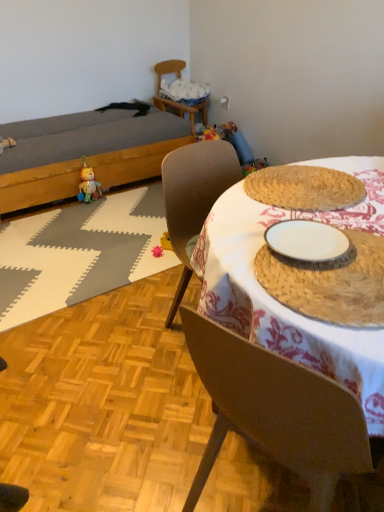
This screenshot has width=384, height=512. Identify the location of white ceramic plate at center. (330, 283).

What do you see at coordinates (79, 253) in the screenshot?
I see `woven straw placemat at center` at bounding box center [79, 253].

Describe the element at coordinates (177, 101) in the screenshot. I see `wooden chair at upper center` at that location.

Locate an element on the screen. The image size is (384, 512). matte gray bed at left is located at coordinates (87, 154).

Where is `pink rubber toy at center, the second toy from the back`? pink rubber toy at center, the second toy from the back is located at coordinates (157, 251).

This screenshot has width=384, height=512. What do you see at coordinates (307, 241) in the screenshot?
I see `white matte plate at center` at bounding box center [307, 241].

What is the approximate width of white matte plate at center?

It is 19.45 centimeters.

The width and height of the screenshot is (384, 512). I want to click on white ceramic plate at center, so click(330, 283).

Considering the positions of point (289, 258) and point (158, 154), is point (289, 258) closer or farther from the camera than point (158, 154)?

Point (289, 258).

Where is `bed above the white ceramic plate at center (from the image's perspective)`? bed above the white ceramic plate at center (from the image's perspective) is located at coordinates (87, 154).

Is white ceramic plate at center oriented away from matte gray bed at left?

No.

Is the depth of white ceramic plate at center less than that of matte gray bed at left?

Yes, white ceramic plate at center is closer to the viewer.

Between point (342, 276) and point (207, 110), which one is positioned behind?

Point (207, 110)

Is white ceramic plate at center aimed at wooden chair at upper center?

No, white ceramic plate at center is not aimed at wooden chair at upper center.

How different are the orientations of white ceramic plate at center and wooden chair at upper center in degrees?

179 degrees.

From the image's perspective, does white ceramic plate at center appear higher than wooden chair at upper center?

No, from the image's perspective, white ceramic plate at center is not on top of wooden chair at upper center.

Considering the sizes of objects pink rubber toy at center, the second toy from the back, and matte gray bed at left in the image provided, who is smaller, pink rubber toy at center, the second toy from the back, or matte gray bed at left?

pink rubber toy at center, the second toy from the back, is smaller.

At what (x,y) coordinates should I click in order to perform the action: click on the 2nd toy below the matte gray bed at left (from a real-world perspective). Please return your answer as a coordinate pair (x, y). Image resolution: width=384 pixels, height=512 pixels. Looking at the image, I should click on (157, 251).

Is pink rubber toy at center, the second toy positioned from the left, inside or outside of matte gray bed at left?

pink rubber toy at center, the second toy positioned from the left, is located beyond the bounds of matte gray bed at left.

Which object is wider, pink rubber toy at center, which is the 2th toy in top-to-bottom order, or matte gray bed at left?

matte gray bed at left.

Considering the sizes of rattan placemat at center and white ceramic plate at center in the image, is rattan placemat at center bigger or smaller than white ceramic plate at center?

Clearly, rattan placemat at center is larger in size than white ceramic plate at center.

Looking at this image, can you confirm if rattan placemat at center is taller than white ceramic plate at center?

Yes.

From a real-world perspective, is rattan placemat at center physically located above or below white ceramic plate at center?

rattan placemat at center is situated lower than white ceramic plate at center in the real world.

Does white ceramic plate at center appear on the left side of pink rubber toy at center, positioned as the first toy in bottom-to-top order?

No, white ceramic plate at center is not to the left of pink rubber toy at center, positioned as the first toy in bottom-to-top order.

Locate an element on the screen. The image size is (384, 512). tableware that appears below the pink rubber toy at center, positioned as the first toy in bottom-to-top order (from the image's perspective) is located at coordinates (330, 283).

Does white ceramic plate at center have a lesser width compared to pink rubber toy at center, the second toy positioned from the left?

No.

Can you confirm if white ceramic plate at center is smaller than pink rubber toy at center, the second toy positioned from the left?

Incorrect, white ceramic plate at center is not smaller in size than pink rubber toy at center, the second toy positioned from the left.

Consider the image. Measure the distance between woven straw placemat at center and plush yellow bear at lower left, the second toy from the right.

woven straw placemat at center is 58.66 centimeters from plush yellow bear at lower left, the second toy from the right.

From a real-world perspective, between woven straw placemat at center and plush yellow bear at lower left, arranged as the first toy when viewed from the top, who is vertically higher?

plush yellow bear at lower left, arranged as the first toy when viewed from the top.

Can you confirm if woven straw placemat at center is shorter than plush yellow bear at lower left, the 2th toy in the front-to-back sequence?

Yes.

How different are the orientations of wooden chair at upper center and pink rubber toy at center, positioned as the first toy in bottom-to-top order, in degrees?

107 degrees separate the facing orientations of wooden chair at upper center and pink rubber toy at center, positioned as the first toy in bottom-to-top order.

From their relative heights in the image, would you say wooden chair at upper center is taller or shorter than pink rubber toy at center, which is the 2th toy in top-to-bottom order?

Clearly, wooden chair at upper center is taller compared to pink rubber toy at center, which is the 2th toy in top-to-bottom order.

Which object is more forward, wooden chair at upper center or pink rubber toy at center, positioned as the first toy in bottom-to-top order?

pink rubber toy at center, positioned as the first toy in bottom-to-top order, is closer to the camera.

Considering the sizes of objects wooden chair at upper center and pink rubber toy at center, the second toy from the back, in the image provided, who is thinner, wooden chair at upper center or pink rubber toy at center, the second toy from the back,?

pink rubber toy at center, the second toy from the back.

At what (x,y) coordinates should I click in order to perform the action: click on tableware located on the right of matte gray bed at left. Please return your answer as a coordinate pair (x, y). This screenshot has height=512, width=384. Looking at the image, I should click on (330, 283).

Locate an element on the screen. This screenshot has height=512, width=384. chair behind the white ceramic plate at center is located at coordinates (177, 101).

Which object lies nearer to the anchor point wooden chair at upper center, white ceramic plate at center or pink rubber toy at center, the second toy positioned from the left?

The object closer to wooden chair at upper center is pink rubber toy at center, the second toy positioned from the left.

Which object lies nearer to the anchor point white ceramic plate at center, plush yellow bear at lower left, acting as the 1th toy starting from the left, or pink rubber toy at center, the second toy from the back?

pink rubber toy at center, the second toy from the back, is closer to white ceramic plate at center.

Which object lies nearer to the anchor point white ceramic plate at center, woven straw placemat at center or rattan placemat at center?

rattan placemat at center is closer to white ceramic plate at center.

When comparing their distances from matte gray bed at left, does plush yellow bear at lower left, the second toy from the right, or white matte plate at center seem closer?

Based on the image, plush yellow bear at lower left, the second toy from the right, appears to be nearer to matte gray bed at left.

Which object lies further to the anchor point matte gray bed at left, woven straw placemat at center or pink rubber toy at center, positioned as the 1th toy in right-to-left order?

Among the two, pink rubber toy at center, positioned as the 1th toy in right-to-left order, is located further to matte gray bed at left.

Considering their positions, is plush yellow bear at lower left, which ranks as the second toy in bottom-to-top order, positioned closer to woven straw placemat at center than rattan placemat at center?

plush yellow bear at lower left, which ranks as the second toy in bottom-to-top order, is closer to woven straw placemat at center.

Based on their spatial positions, is white ceramic plate at center or matte gray bed at left closer to white matte plate at center?

white ceramic plate at center lies closer to white matte plate at center than the other object.

Looking at the image, which one is located closer to plush yellow bear at lower left, which appears as the first toy when viewed from the back, matte gray bed at left or pink rubber toy at center, positioned as the 1th toy in right-to-left order?

The object closer to plush yellow bear at lower left, which appears as the first toy when viewed from the back, is matte gray bed at left.

This screenshot has width=384, height=512. In order to click on toy between matte gray bed at left and pink rubber toy at center, positioned as the 1th toy in right-to-left order, vertically in this screenshot , I will do `click(88, 186)`.

I want to click on place mat located between white matte plate at center and plush yellow bear at lower left, which appears as the first toy when viewed from the back, in the depth direction, so click(79, 253).

Locate an element on the screen. plate between rattan placemat at center and pink rubber toy at center, positioned as the first toy in bottom-to-top order, in the front-back direction is located at coordinates (307, 241).

Image resolution: width=384 pixels, height=512 pixels. What are the coordinates of `plate located between rattan placemat at center and woven straw placemat at center in the depth direction` in the screenshot? It's located at [307, 241].